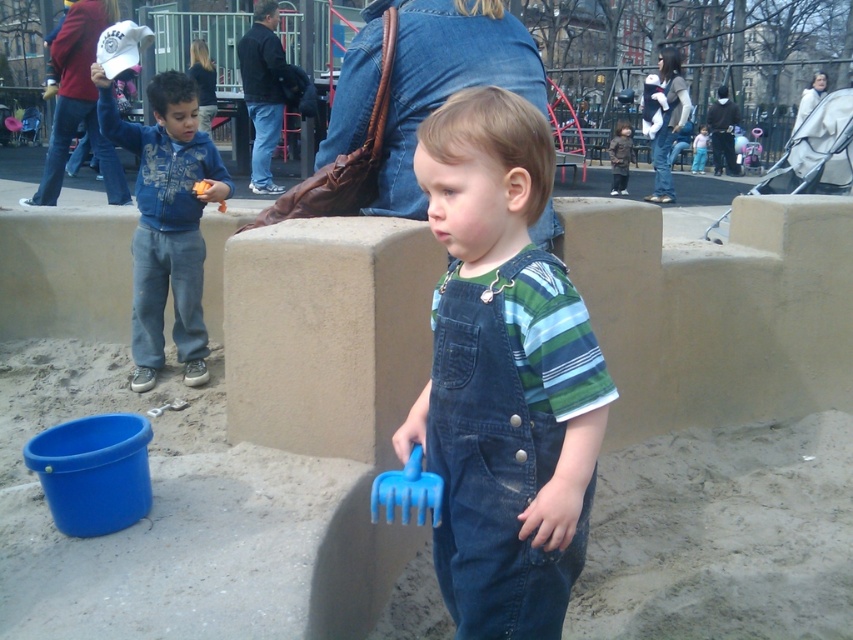
Is the position of denim overalls at center more distant than that of blue fleece jacket at left?

No, denim overalls at center is closer to the viewer.

Does point (442, 564) come farther from viewer compared to point (152, 108)?

No.

Which is in front, point (473, 356) or point (181, 360)?

Point (473, 356)

Identify the location of denim overalls at center. tap(503, 376).